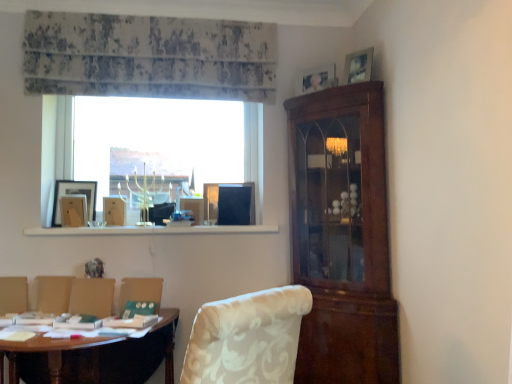
Question: Is wooden picture frame at upper left, which ranks as the 3th picture frame in right-to-left order, to the left or to the right of white floral fabric armchair at lower left, the 4th armchair from the right, in the image?

Choices:
 (A) left
 (B) right

Answer: (B)

Question: From a real-world perspective, is wooden picture frame at upper left, the first picture frame ordered from the bottom, positioned above or below white floral fabric armchair at lower left, positioned as the first armchair in left-to-right order?

Choices:
 (A) below
 (B) above

Answer: (B)

Question: Considering the real-world distances, which object is closest to the white floral fabric armchair at lower left, positioned as the first armchair in left-to-right order?

Choices:
 (A) wooden picture frame at upper right, which is the fourth picture frame in left-to-right order
 (B) wooden picture frame at left, the 4th picture frame when ordered from right to left
 (C) white floral fabric armchair at lower left, placed as the 2th armchair when sorted from left to right
 (D) white glossy window sill at center
 (E) wooden picture frame at upper left, the first picture frame ordered from the bottom

Answer: (C)

Question: Which of these objects is positioned farthest from the white floral fabric armchair at lower center, arranged as the third armchair when viewed from the left?

Choices:
 (A) wooden picture frame at upper right, which is counted as the 1th picture frame, starting from the top
 (B) matte silver picture frame at upper right, the second picture frame when ordered from top to bottom
 (C) wooden table at lower left
 (D) wooden picture frame at left, which appears as the 3th picture frame when viewed from the top
 (E) wooden picture frame at upper left, which ranks as the 3th picture frame in right-to-left order

Answer: (A)